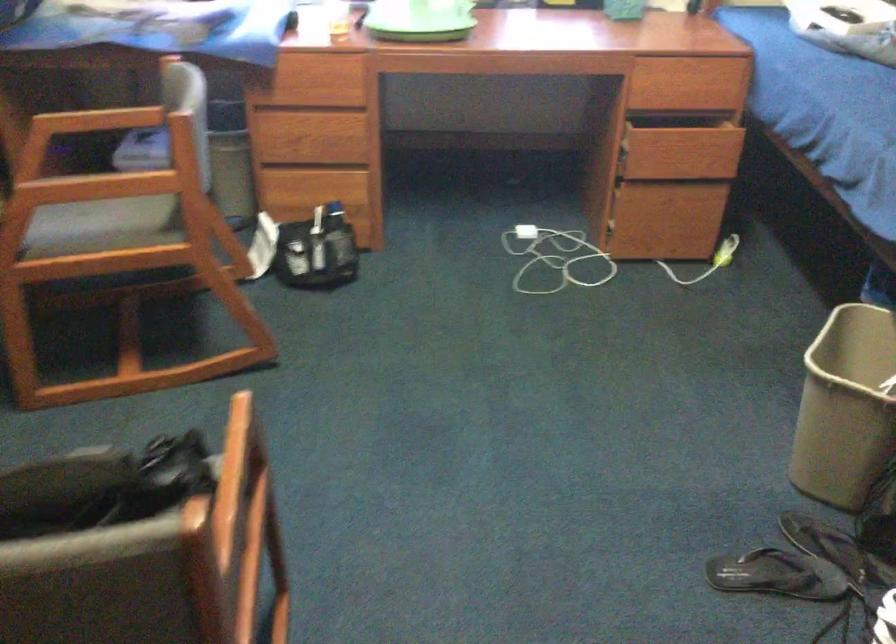
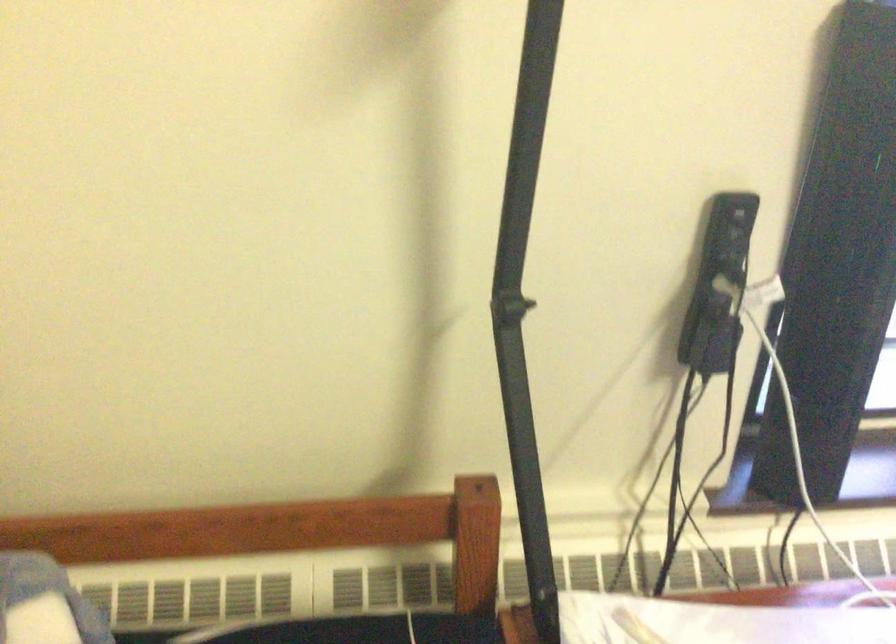
Which direction would the cameraman need to move to produce the second image?

The movement direction of the cameraman is left, forward.